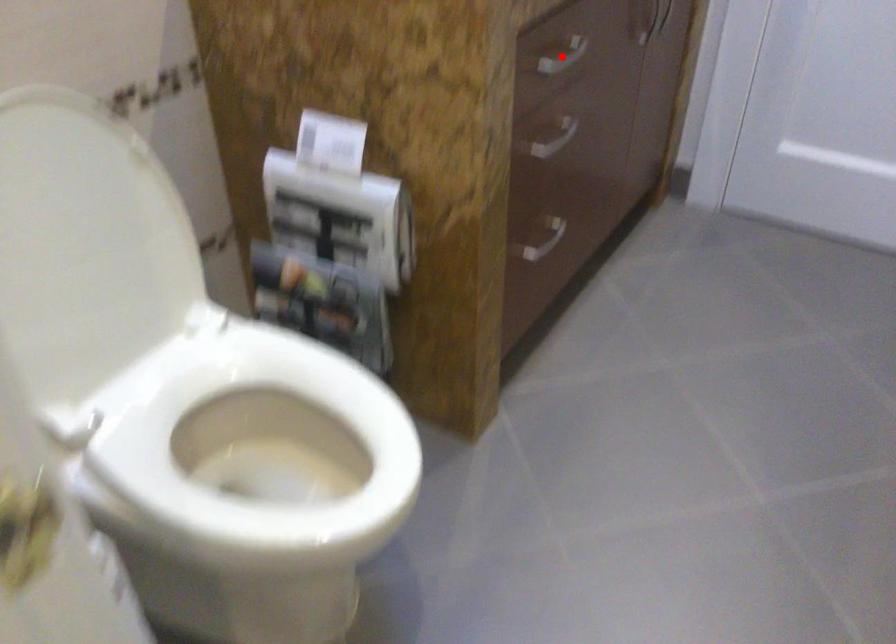
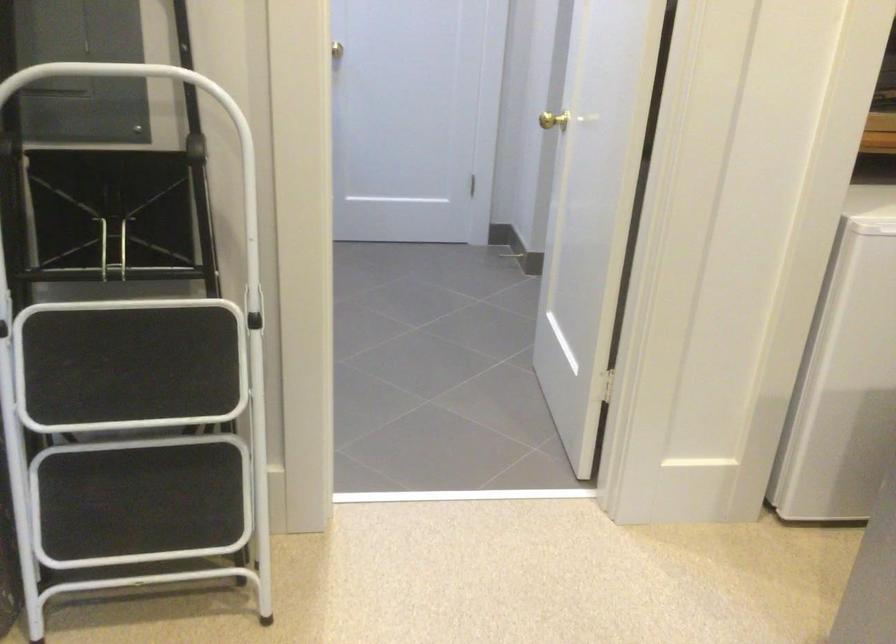
Question: I am providing you with two images of the same scene from different viewpoints. A red point is marked on the first image. Can you still see the location of the red point in image 2?

Choices:
 (A) Yes
 (B) No

Answer: (B)